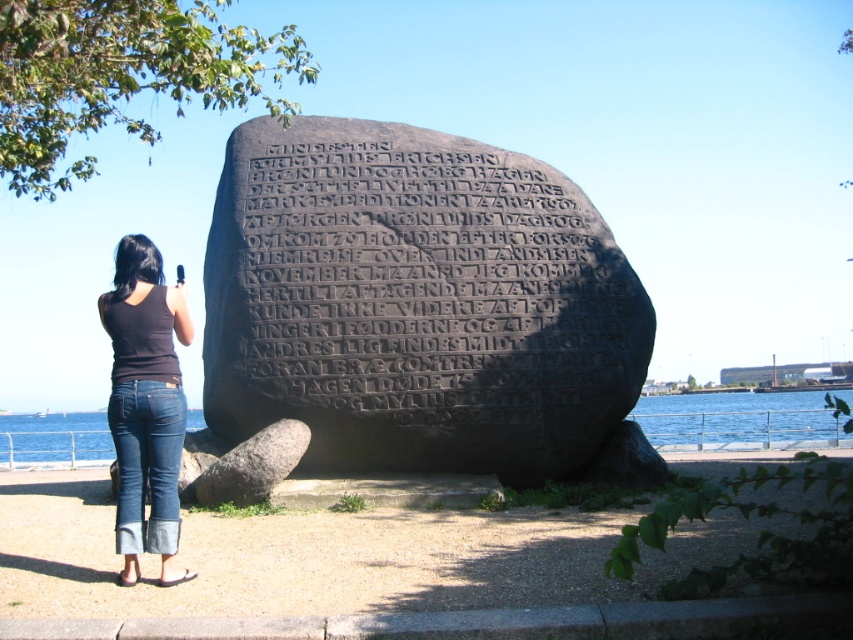
Who is positioned more to the left, black stone engraving at center or blue water at lower center?

black stone engraving at center is more to the left.

Based on the photo, is black stone engraving at center to the left of blue water at lower center from the viewer's perspective?

Correct, you'll find black stone engraving at center to the left of blue water at lower center.

Does point (538, 161) lie behind point (766, 410)?

That is False.

In order to click on black stone engraving at center in this screenshot , I will do `click(421, 307)`.

Is denim jeans at lower left bigger than blue water at lower center?

Incorrect, denim jeans at lower left is not larger than blue water at lower center.

Can you confirm if denim jeans at lower left is thinner than blue water at lower center?

Yes.

Is point (157, 372) less distant than point (199, 422)?

Yes, point (157, 372) is in front of point (199, 422).

What are the coordinates of `denim jeans at lower left` in the screenshot? It's located at (144, 404).

Is black stone engraving at center thinner than denim jeans at lower left?

No, black stone engraving at center is not thinner than denim jeans at lower left.

Can you confirm if black stone engraving at center is positioned to the right of denim jeans at lower left?

Indeed, black stone engraving at center is positioned on the right side of denim jeans at lower left.

I want to click on black stone engraving at center, so tap(421, 307).